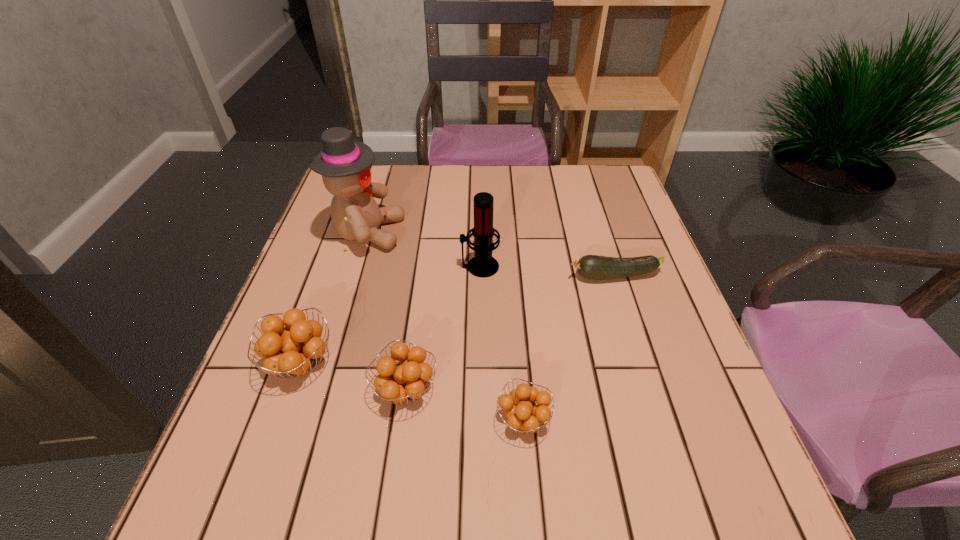
The height and width of the screenshot is (540, 960). I want to click on vacant space situated on the back of the tallest orange fruit, so click(x=332, y=269).

Where is `vacant space located 0.240m on the left of the second shortest orange fruit`? This screenshot has height=540, width=960. vacant space located 0.240m on the left of the second shortest orange fruit is located at coordinates (247, 389).

You are a GUI agent. You are given a task and a screenshot of the screen. Output one action in this format:
    pyautogui.click(x=<x>, y=<y>)
    Task: Click on the vacant space located on the left of the second shortest object
    This screenshot has height=540, width=960.
    Given the screenshot: What is the action you would take?
    pyautogui.click(x=413, y=420)

Find the location of a particular element. Image resolution: width=960 pixels, height=540 pixels. free space located 0.080m on the front-facing side of the tallest object is located at coordinates (433, 233).

This screenshot has height=540, width=960. What are the coordinates of `vacant area situated on the front of the microphone` in the screenshot? It's located at pyautogui.click(x=480, y=348).

Find the location of `free spot located at the blossom end of the rightmost object`. free spot located at the blossom end of the rightmost object is located at coordinates (410, 276).

Locate an element on the screen. free space located at the blossom end of the rightmost object is located at coordinates (447, 276).

Find the location of a particular element. free space located 0.330m at the blossom end of the rightmost object is located at coordinates (431, 276).

Identify the location of object present at the far edge. (345, 165).

I want to click on orange fruit that is at the left edge, so click(x=293, y=349).